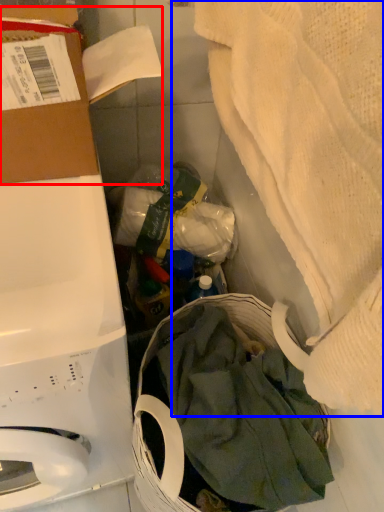
Question: Among these objects, which one is farthest to the camera, cardboard box (highlighted by a red box) or blanket (highlighted by a blue box)?

Choices:
 (A) cardboard box
 (B) blanket

Answer: (A)